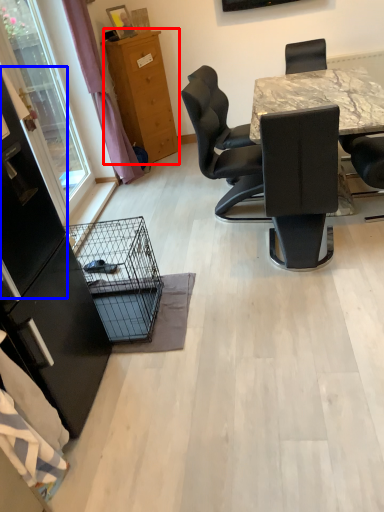
Question: Which point is further to the camera, cabinetry (highlighted by a red box) or screen door (highlighted by a blue box)?

Choices:
 (A) cabinetry
 (B) screen door

Answer: (A)